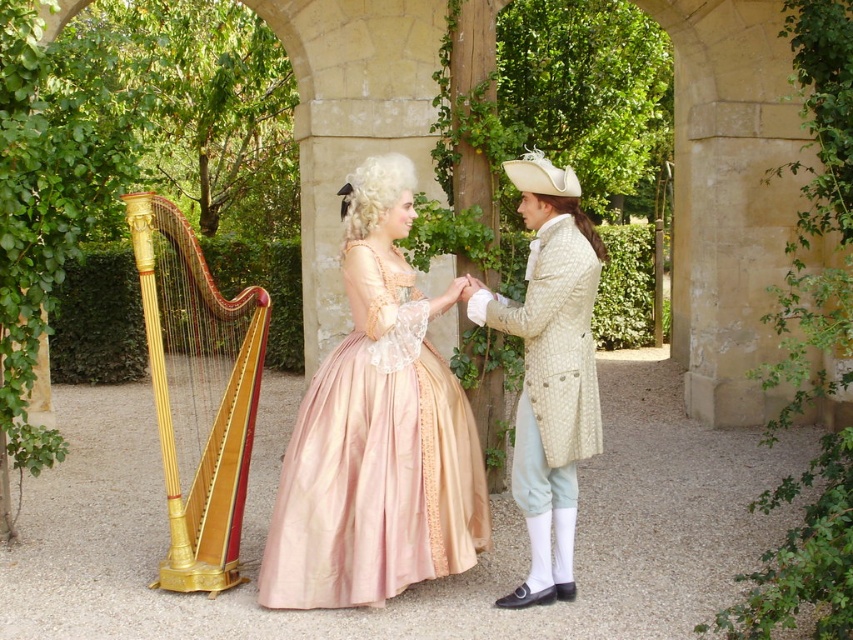
Does point (349, 604) lie in front of point (202, 577)?

Yes.

Between pink satin dress at center and gold polished wood harp at left, which one appears on the left side from the viewer's perspective?

gold polished wood harp at left

Between point (326, 572) and point (224, 513), which one is positioned behind?

The point (224, 513) is more distant.

Identify the location of pink satin dress at center. This screenshot has width=853, height=640. (376, 458).

Is the position of pink satin dress at center less distant than that of light beige textured coat at center?

No, pink satin dress at center is behind light beige textured coat at center.

The height and width of the screenshot is (640, 853). What do you see at coordinates (376, 458) in the screenshot?
I see `pink satin dress at center` at bounding box center [376, 458].

At what (x,y) coordinates should I click in order to perform the action: click on pink satin dress at center. Please return your answer as a coordinate pair (x, y). This screenshot has height=640, width=853. Looking at the image, I should click on (376, 458).

What do you see at coordinates (198, 392) in the screenshot? Image resolution: width=853 pixels, height=640 pixels. I see `gold polished wood harp at left` at bounding box center [198, 392].

Where is `gold polished wood harp at left`? gold polished wood harp at left is located at coordinates click(x=198, y=392).

Which is in front, point (190, 300) or point (543, 429)?

Point (543, 429)

The image size is (853, 640). I want to click on gold polished wood harp at left, so click(198, 392).